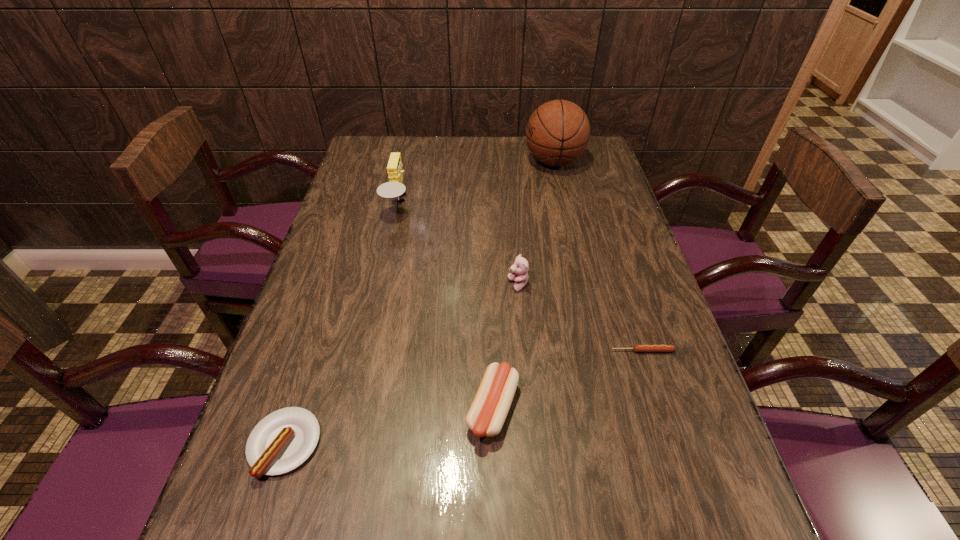
The width and height of the screenshot is (960, 540). What are the coordinates of `the second closest object to the third tallest object` in the screenshot? It's located at (636, 348).

Where is `object that ranks as the fourth closest to the shortest sausage`? The height and width of the screenshot is (540, 960). object that ranks as the fourth closest to the shortest sausage is located at coordinates (394, 188).

You are a GUI agent. You are given a task and a screenshot of the screen. Output one action in this format:
    pyautogui.click(x=<x>, y=<y>)
    Task: Click on the sausage that stands as the second closest to the leftmost sausage
    The height and width of the screenshot is (540, 960).
    Given the screenshot: What is the action you would take?
    pyautogui.click(x=636, y=348)

Select which sausage appears as the second closest to the farthest object. Please provide its 2D coordinates. Your answer should be formatted as a tuple, i.e. [(x, y)], where the tuple contains the x and y coordinates of a point satisfying the conditions above.

[(486, 416)]

The image size is (960, 540). I want to click on free space that satisfies the following two spatial constraints: 1. at the face of the third farthest object; 2. on the front side of the third shortest object, so click(529, 409).

Find the location of a particular element. The image size is (960, 540). free space that satisfies the following two spatial constraints: 1. on the front-facing side of the shortest sausage; 2. on the right side of the fifth shortest object is located at coordinates (366, 351).

At what (x,y) coordinates should I click in order to perform the action: click on vacant space that satisfies the following two spatial constraints: 1. at the face of the fourth farthest object; 2. on the left side of the teddy bear. Please return your answer as a coordinate pair (x, y). The image size is (960, 540). Looking at the image, I should click on (524, 351).

The height and width of the screenshot is (540, 960). Identify the location of vacant area that satisfies the following two spatial constraints: 1. on the front-facing side of the second tallest object; 2. on the left side of the rightmost sausage. (366, 351).

Where is `blank space that satisfies the following two spatial constraints: 1. at the face of the fourth shortest object; 2. on the left side of the farthest sausage`? This screenshot has width=960, height=540. blank space that satisfies the following two spatial constraints: 1. at the face of the fourth shortest object; 2. on the left side of the farthest sausage is located at coordinates (524, 351).

Locate an element on the screen. vacant space that satisfies the following two spatial constraints: 1. on the back side of the second sausage from right to left; 2. on the front-facing side of the second object from left to right is located at coordinates (489, 203).